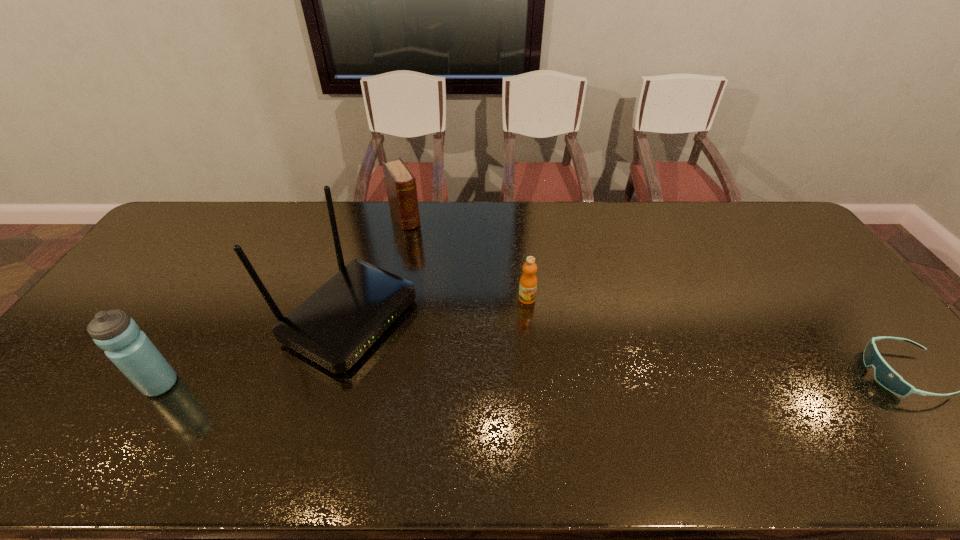
Find the location of `vacant space on the desktop that is between the leftmost object and the rightmost object and is positioned on the front-facing side of the tallest object`. vacant space on the desktop that is between the leftmost object and the rightmost object and is positioned on the front-facing side of the tallest object is located at coordinates (468, 380).

Where is `free space on the desktop that is between the leftmost object and the shortest object and is positioned on the spine side of the farthest object`? free space on the desktop that is between the leftmost object and the shortest object and is positioned on the spine side of the farthest object is located at coordinates (508, 379).

This screenshot has height=540, width=960. In order to click on vacant space on the desktop that is between the water bottle and the goggles and is positioned on the front label of the orange juice in this screenshot , I will do `click(540, 379)`.